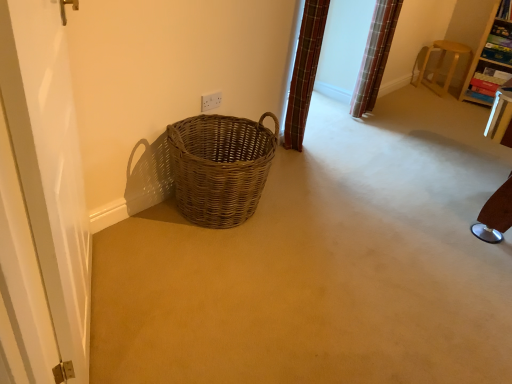
Where is `vacant space in white glossy screen door at left (from a real-world perspective)`? The width and height of the screenshot is (512, 384). vacant space in white glossy screen door at left (from a real-world perspective) is located at coordinates (96, 307).